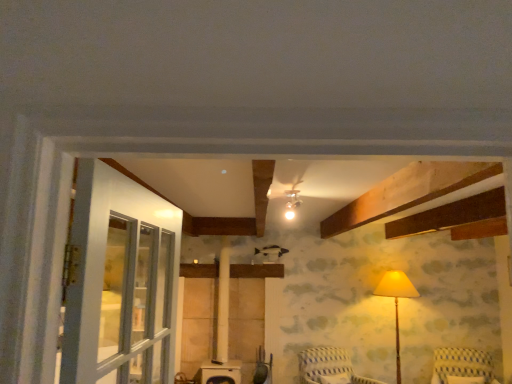
Question: Are striped fabric chair at lower center, the second furniture in the right-to-left sequence, and yellow striped fabric chair at lower right, which is the second furniture from left to right, making contact?

Choices:
 (A) yes
 (B) no

Answer: (B)

Question: Does striped fabric chair at lower center, acting as the first furniture starting from the left, appear on the left side of yellow striped fabric chair at lower right, which is the second furniture from left to right?

Choices:
 (A) no
 (B) yes

Answer: (B)

Question: From a real-world perspective, is striped fabric chair at lower center, acting as the first furniture starting from the left, located higher than yellow striped fabric chair at lower right, which is the second furniture from left to right?

Choices:
 (A) yes
 (B) no

Answer: (B)

Question: From a real-world perspective, is striped fabric chair at lower center, acting as the first furniture starting from the left, below yellow striped fabric chair at lower right, which is the second furniture from left to right?

Choices:
 (A) no
 (B) yes

Answer: (B)

Question: Is striped fabric chair at lower center, the second furniture in the right-to-left sequence, in front of yellow striped fabric chair at lower right, the first furniture when ordered from right to left?

Choices:
 (A) no
 (B) yes

Answer: (B)

Question: Do you think matte yellow fabric lampshade at right is within yellow striped fabric chair at lower right, which is the second furniture from left to right, or outside of it?

Choices:
 (A) inside
 (B) outside

Answer: (B)

Question: Based on their positions, is matte yellow fabric lampshade at right located to the left or right of yellow striped fabric chair at lower right, which is the second furniture from left to right?

Choices:
 (A) left
 (B) right

Answer: (A)

Question: Looking at the image, does matte yellow fabric lampshade at right seem bigger or smaller compared to yellow striped fabric chair at lower right, which is the second furniture from left to right?

Choices:
 (A) small
 (B) big

Answer: (B)

Question: In terms of height, does matte yellow fabric lampshade at right look taller or shorter compared to yellow striped fabric chair at lower right, which is the second furniture from left to right?

Choices:
 (A) tall
 (B) short

Answer: (A)

Question: From a real-world perspective, relative to yellow striped fabric chair at lower right, the first furniture when ordered from right to left, is striped fabric chair at lower center, the second furniture in the right-to-left sequence, vertically above or below?

Choices:
 (A) above
 (B) below

Answer: (B)

Question: In terms of height, does striped fabric chair at lower center, acting as the first furniture starting from the left, look taller or shorter compared to yellow striped fabric chair at lower right, the first furniture when ordered from right to left?

Choices:
 (A) short
 (B) tall

Answer: (B)

Question: From the image's perspective, relative to yellow striped fabric chair at lower right, the first furniture when ordered from right to left, is striped fabric chair at lower center, acting as the first furniture starting from the left, above or below?

Choices:
 (A) above
 (B) below

Answer: (A)

Question: Based on their positions, is striped fabric chair at lower center, the second furniture in the right-to-left sequence, located to the left or right of yellow striped fabric chair at lower right, which is the second furniture from left to right?

Choices:
 (A) left
 (B) right

Answer: (A)

Question: Is point (400, 292) positioned closer to the camera than point (348, 367)?

Choices:
 (A) farther
 (B) closer

Answer: (A)

Question: From a real-world perspective, is matte yellow fabric lampshade at right above or below striped fabric chair at lower center, the second furniture in the right-to-left sequence?

Choices:
 (A) above
 (B) below

Answer: (A)